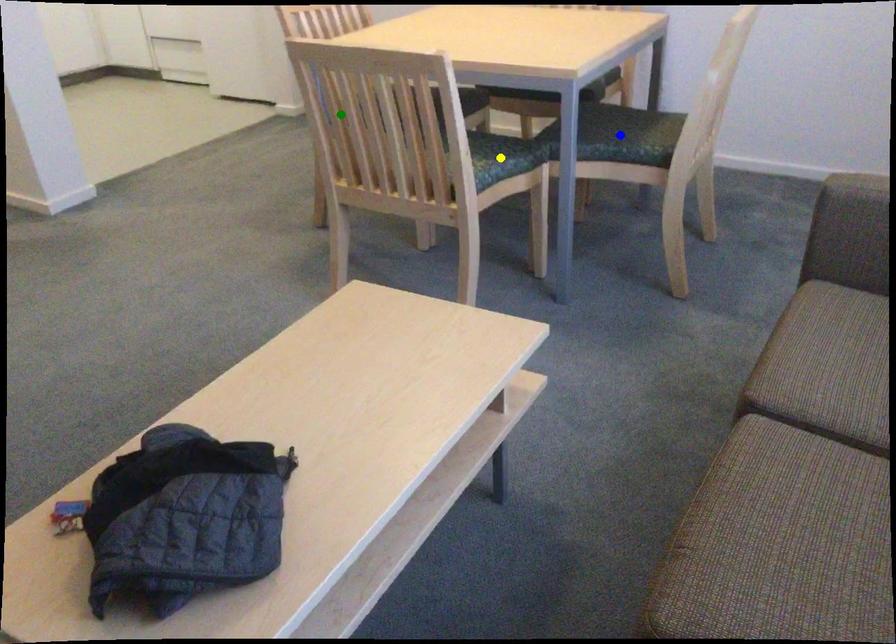
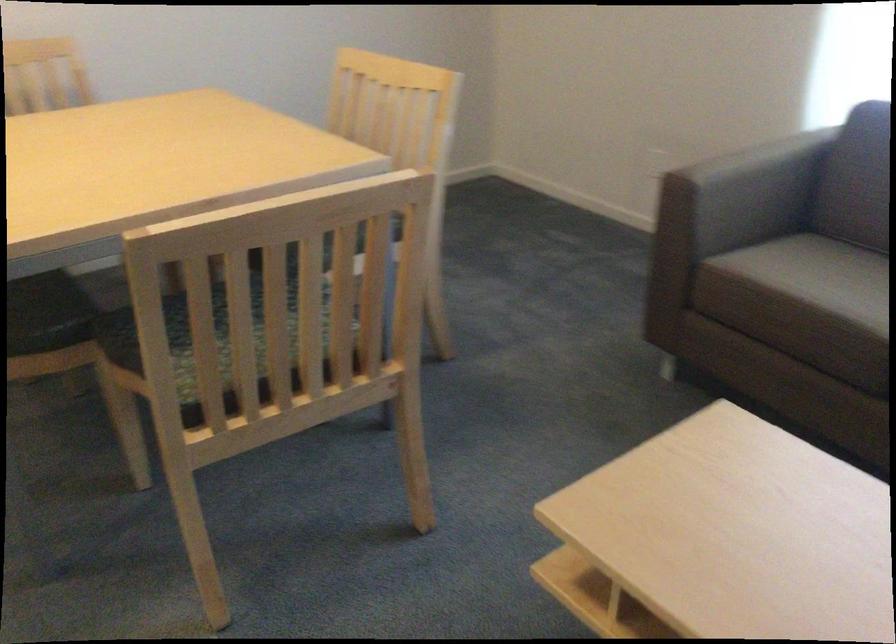
I am providing you with two images of the same scene from different viewpoints. Three points are marked in image1. Which point corresponds to a part or object that is occluded in image2?In image1, three points are marked. Which of them correspond to a part or object that is occluded in image2?Among the three points shown in image1, which one corresponds to a part or object that is no longer visible due to occlusion in image2?

Invisible in image2: blue point, yellow point.